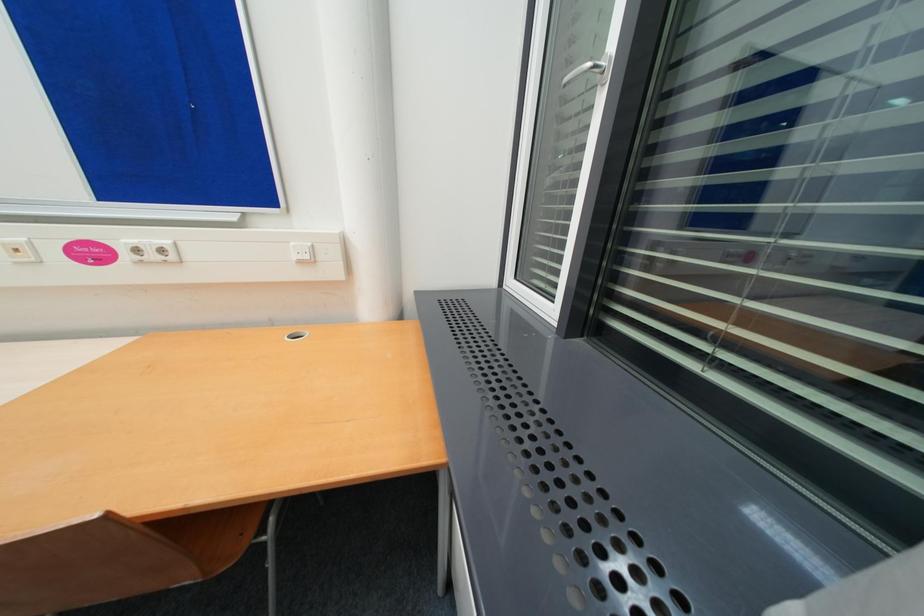
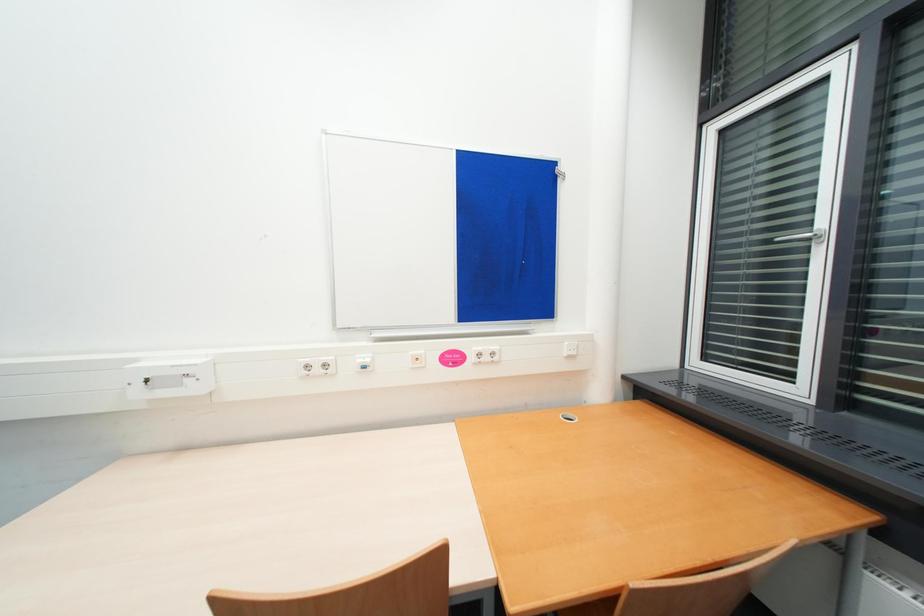
Question: Which direction would the cameraman need to move to produce the second image? Reply with the corresponding letter.

Choices:
 (A) Left
 (B) Right
 (C) Forward
 (D) Backward

Answer: (A)